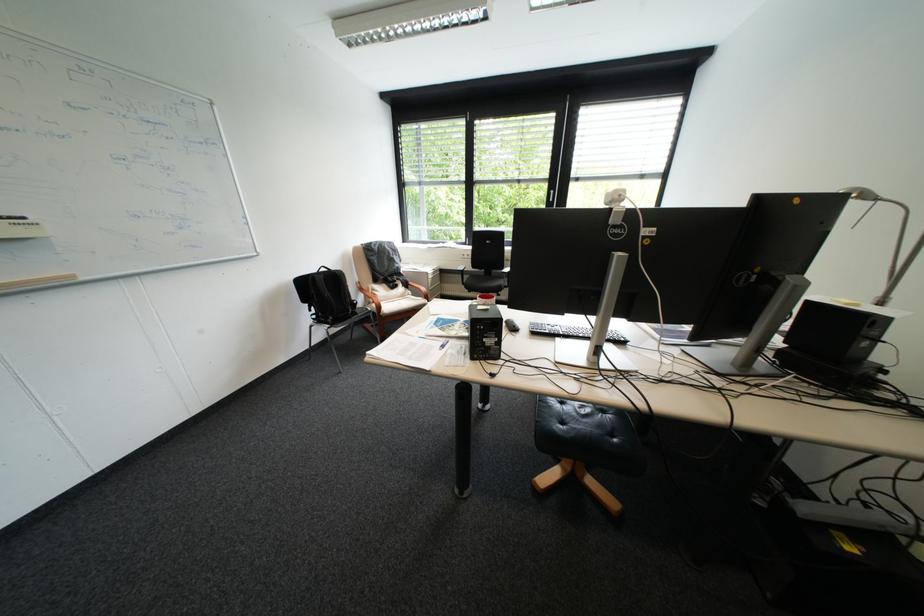
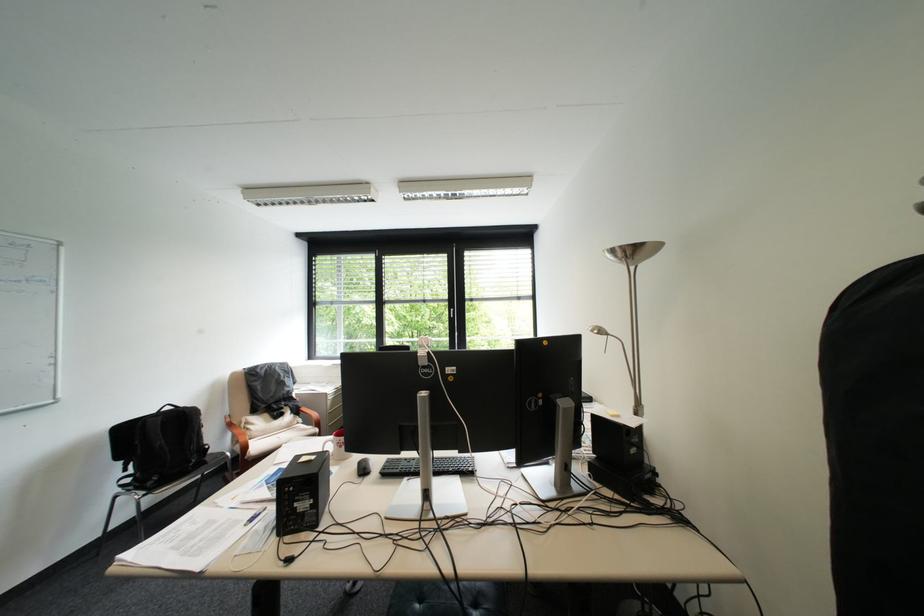
Question: The images are taken continuously from a first-person perspective. In which direction is your viewpoint rotating?

Choices:
 (A) Left
 (B) Right
 (C) Up
 (D) Down

Answer: (C)